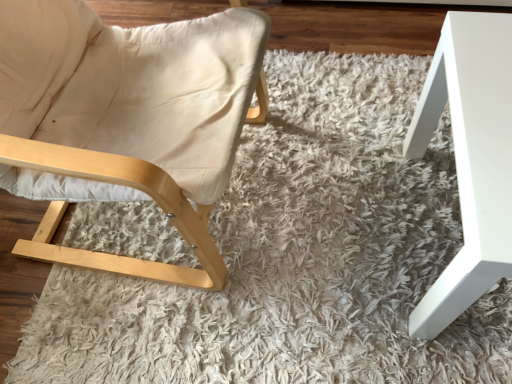
Question: Can you confirm if white glossy table at right is smaller than beige fabric chair at left?

Choices:
 (A) no
 (B) yes

Answer: (B)

Question: Does white glossy table at right lie in front of beige fabric chair at left?

Choices:
 (A) yes
 (B) no

Answer: (B)

Question: Is white glossy table at right surrounding beige fabric chair at left?

Choices:
 (A) yes
 (B) no

Answer: (B)

Question: From a real-world perspective, is white glossy table at right over beige fabric chair at left?

Choices:
 (A) no
 (B) yes

Answer: (A)

Question: Is white glossy table at right aimed at beige fabric chair at left?

Choices:
 (A) yes
 (B) no

Answer: (B)

Question: From a real-world perspective, is white glossy table at right under beige fabric chair at left?

Choices:
 (A) yes
 (B) no

Answer: (A)

Question: Does beige fabric chair at left turn towards white glossy table at right?

Choices:
 (A) yes
 (B) no

Answer: (A)

Question: Considering the relative sizes of beige fabric chair at left and white glossy table at right in the image provided, is beige fabric chair at left thinner than white glossy table at right?

Choices:
 (A) yes
 (B) no

Answer: (B)

Question: From the image's perspective, does beige fabric chair at left appear higher than white glossy table at right?

Choices:
 (A) no
 (B) yes

Answer: (B)

Question: Is beige fabric chair at left taller than white glossy table at right?

Choices:
 (A) no
 (B) yes

Answer: (B)

Question: Are beige fabric chair at left and white glossy table at right beside each other?

Choices:
 (A) no
 (B) yes

Answer: (A)

Question: Is beige fabric chair at left not close to white glossy table at right?

Choices:
 (A) yes
 (B) no

Answer: (B)

Question: From the image's perspective, is white glossy table at right located above or below beige fabric chair at left?

Choices:
 (A) above
 (B) below

Answer: (B)